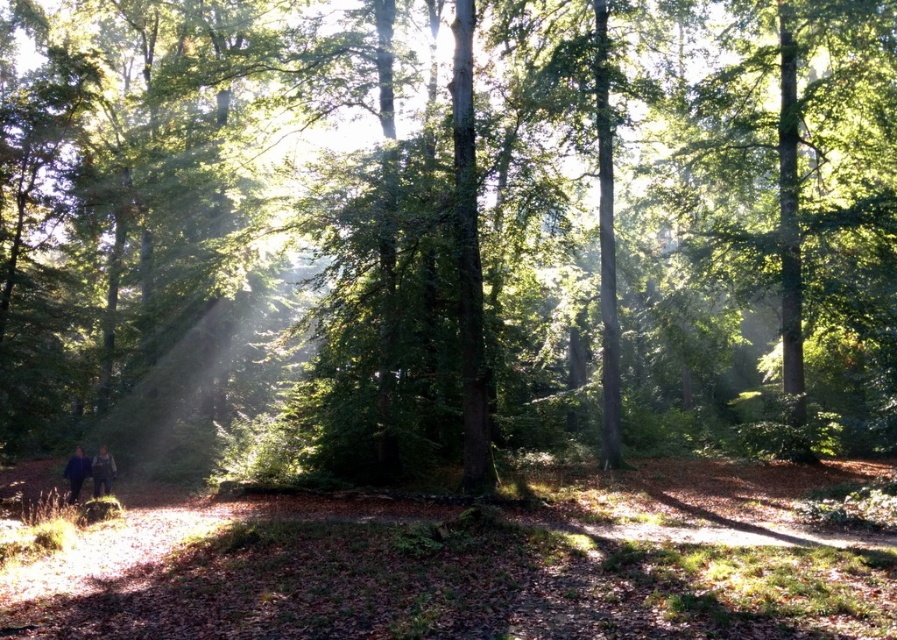
Question: Is dark blue fabric at lower left thinner than dark blue jacket at lower left?

Choices:
 (A) no
 (B) yes

Answer: (B)

Question: Observing the image, what is the correct spatial positioning of dark blue fabric at lower left in reference to dark blue jacket at lower left?

Choices:
 (A) left
 (B) right

Answer: (B)

Question: Among these objects, which one is farthest from the camera?

Choices:
 (A) dark blue fabric at lower left
 (B) dark blue jacket at lower left

Answer: (A)

Question: Which object appears farthest from the camera in this image?

Choices:
 (A) dark blue fabric at lower left
 (B) dark blue jacket at lower left

Answer: (A)

Question: Does dark blue fabric at lower left appear on the right side of dark blue jacket at lower left?

Choices:
 (A) no
 (B) yes

Answer: (B)

Question: Which object appears farthest from the camera in this image?

Choices:
 (A) dark blue jacket at lower left
 (B) dark blue fabric at lower left

Answer: (B)